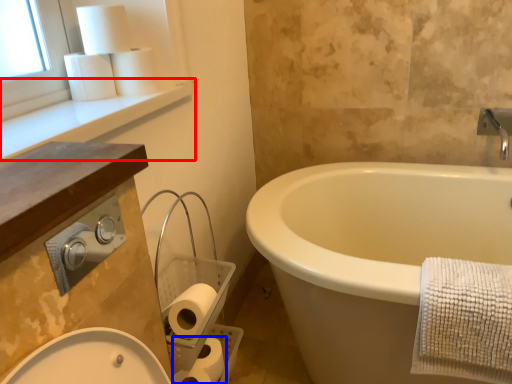
Question: Which object is closer to the camera taking this photo, window sill (highlighted by a red box) or toilet paper (highlighted by a blue box)?

Choices:
 (A) window sill
 (B) toilet paper

Answer: (A)